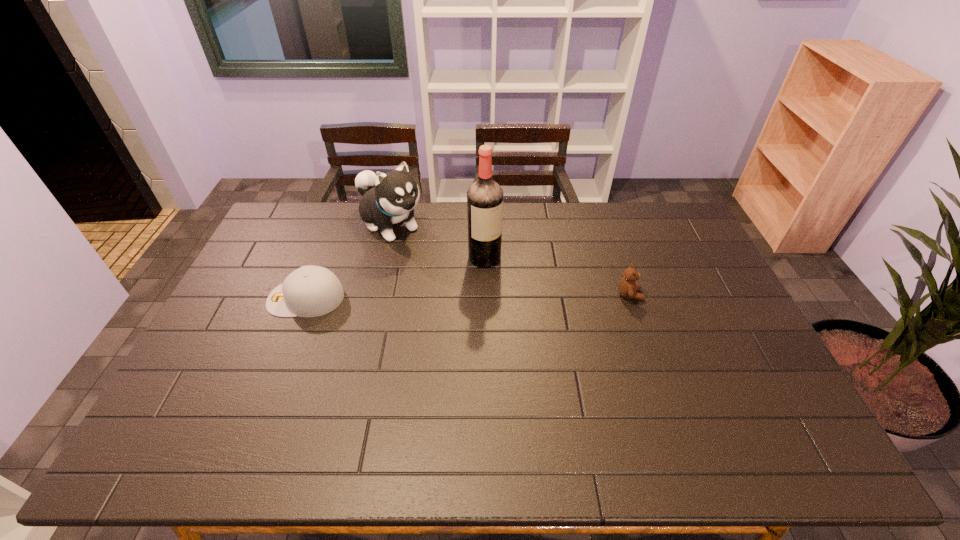
You are a GUI agent. You are given a task and a screenshot of the screen. Output one action in this format:
    pyautogui.click(x=<x>, y=<y>)
    Task: Click on the vacant spot on the desktop that is between the cap and the teddy bear and is positioned at the face of the puppy
    Image resolution: width=960 pixels, height=540 pixels.
    Given the screenshot: What is the action you would take?
    pyautogui.click(x=473, y=296)

Locate an element on the screen. vacant space on the desktop that is between the shortest object and the teddy bear and is positioned on the front-facing side of the third object from left to right is located at coordinates (516, 296).